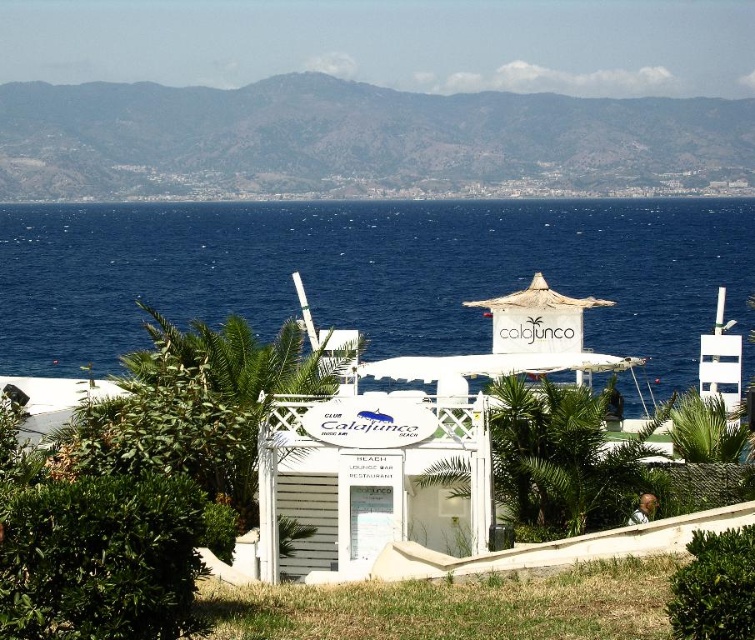
Question: Where is blue water at center located in relation to green grassy hillside at upper center in the image?

Choices:
 (A) right
 (B) left

Answer: (A)

Question: Does blue water at center have a greater width compared to green grassy hillside at upper center?

Choices:
 (A) yes
 (B) no

Answer: (B)

Question: Does blue water at center have a greater width compared to green grassy hillside at upper center?

Choices:
 (A) no
 (B) yes

Answer: (A)

Question: Which point is farther from the camera taking this photo?

Choices:
 (A) (470, 224)
 (B) (683, 140)

Answer: (B)

Question: Which object appears farthest from the camera in this image?

Choices:
 (A) blue water at center
 (B) green grassy hillside at upper center

Answer: (B)